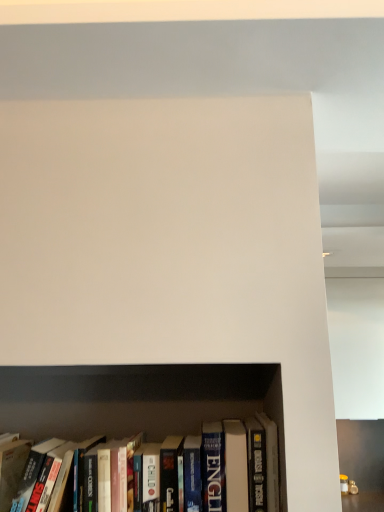
This screenshot has width=384, height=512. Describe the element at coordinates (117, 419) in the screenshot. I see `hardcover books at lower center` at that location.

Locate an element on the screen. Image resolution: width=384 pixels, height=512 pixels. hardcover books at lower center is located at coordinates (117, 419).

Measure the distance between point (161, 407) and camera.

The depth of point (161, 407) is 3.60 feet.

Find the location of a particular element. The image size is (384, 512). hardcover books at lower center is located at coordinates (117, 419).